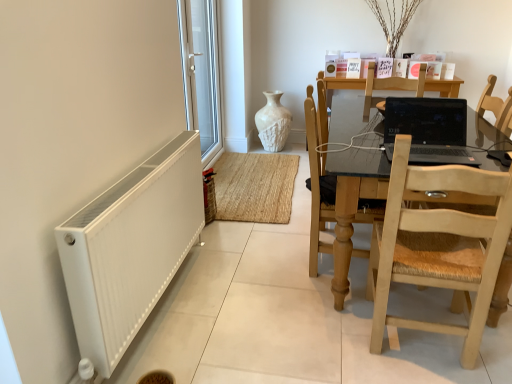
The height and width of the screenshot is (384, 512). What are the coordinates of `vacant area that lies to the right of white matte radiator at lower left` in the screenshot? It's located at tap(259, 312).